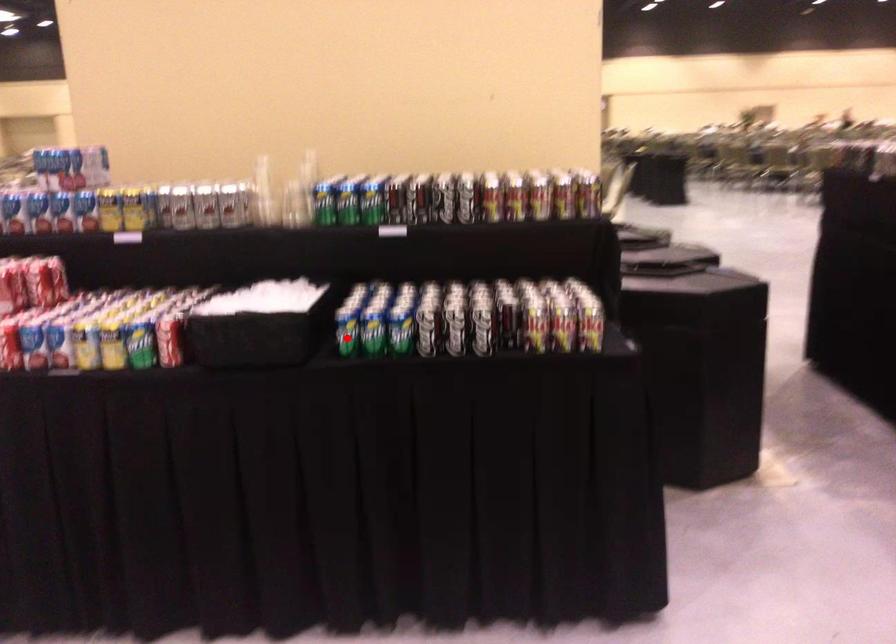
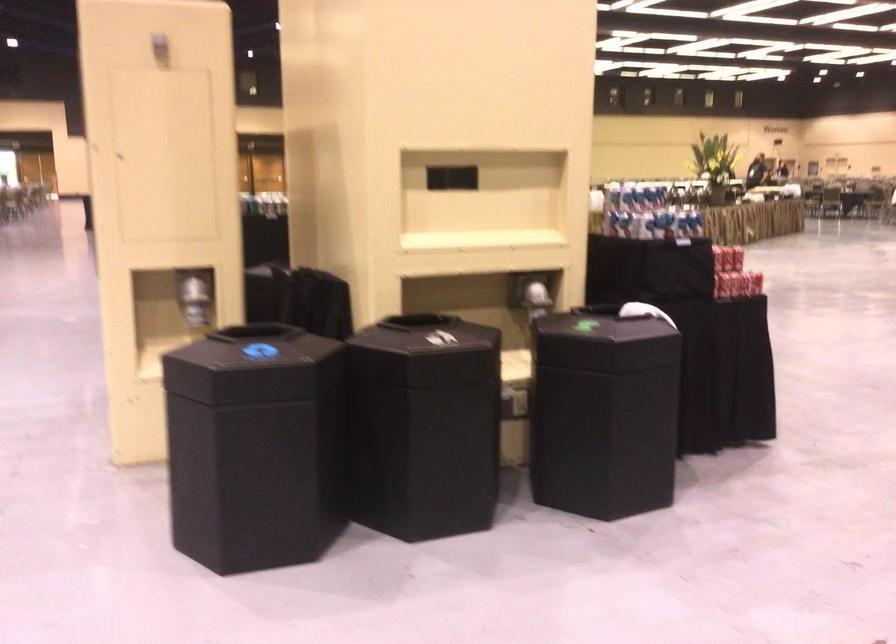
Question: I am providing you with two images of the same scene from different viewpoints. A red point is marked on the first image. At the location where the point appears in image 1, is it still visible in image 2?

Choices:
 (A) Yes
 (B) No

Answer: (B)